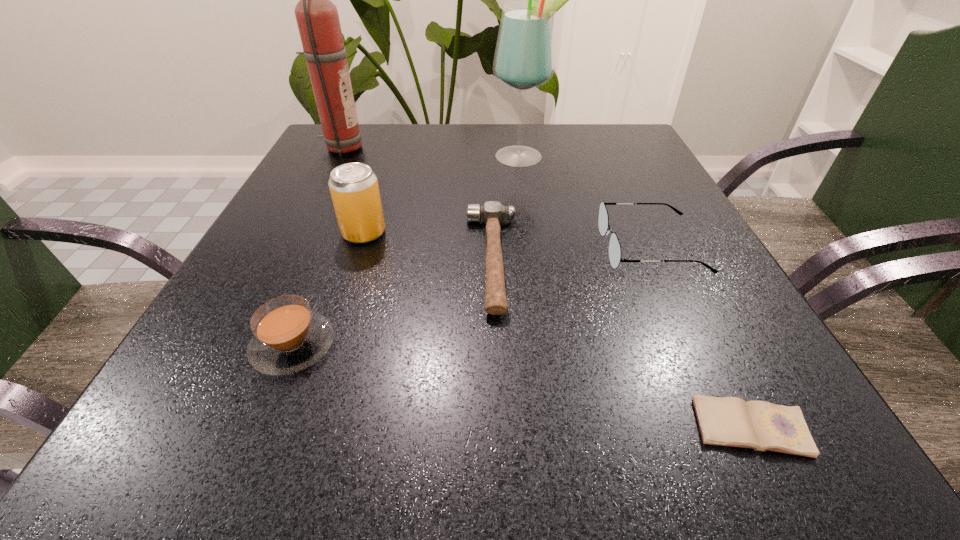
At what (x,y) coordinates should I click in order to perform the action: click on free spot that satisfies the following two spatial constraints: 1. on the back side of the pop (soda); 2. on the side of the fire extinguisher with the label and nozzle. Please return your answer as a coordinate pair (x, y). Image resolution: width=960 pixels, height=540 pixels. Looking at the image, I should click on (392, 148).